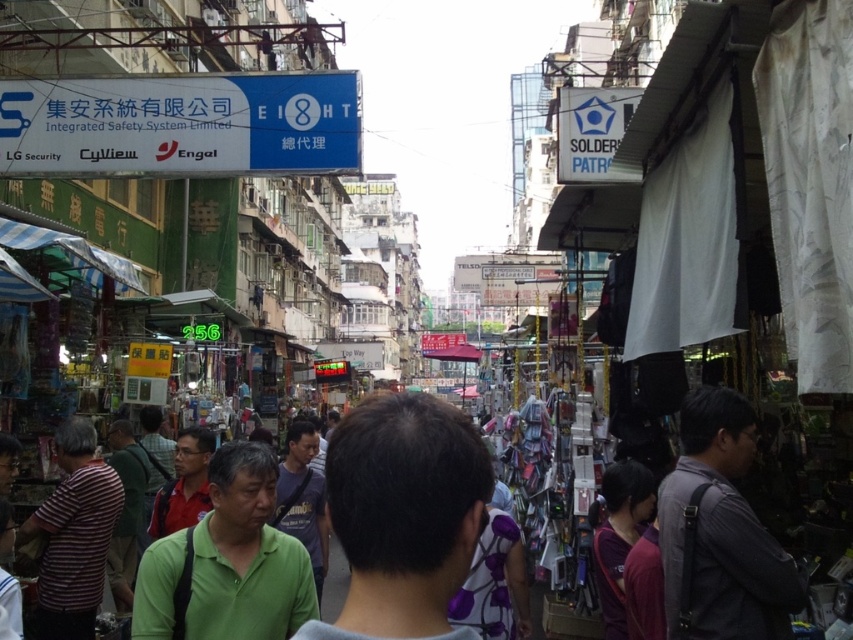
Is dark gray shirt at center to the right of green textured shirt at center from the viewer's perspective?

Correct, you'll find dark gray shirt at center to the right of green textured shirt at center.

Is dark gray shirt at center shorter than green textured shirt at center?

Incorrect, dark gray shirt at center's height does not fall short of green textured shirt at center's.

At what (x,y) coordinates should I click in order to perform the action: click on dark gray shirt at center. Please return your answer as a coordinate pair (x, y). Looking at the image, I should click on (721, 531).

What do you see at coordinates (721, 531) in the screenshot? This screenshot has width=853, height=640. I see `dark gray shirt at center` at bounding box center [721, 531].

Is point (735, 458) farther from camera compared to point (85, 484)?

No, (735, 458) is closer to viewer.

At what (x,y) coordinates should I click in order to perform the action: click on dark gray shirt at center. Please return your answer as a coordinate pair (x, y). The height and width of the screenshot is (640, 853). Looking at the image, I should click on (721, 531).

Can you confirm if dark green shirt at center is thinner than striped fabric shirt at lower left?

No, dark green shirt at center is not thinner than striped fabric shirt at lower left.

Is dark green shirt at center closer to the viewer compared to striped fabric shirt at lower left?

That is True.

Find the location of a particular element. The width and height of the screenshot is (853, 640). dark green shirt at center is located at coordinates (403, 515).